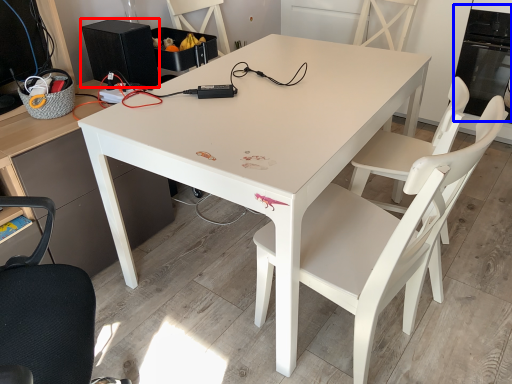
Question: Which object appears farthest to the camera in this image, appliance (highlighted by a red box) or oven (highlighted by a blue box)?

Choices:
 (A) appliance
 (B) oven

Answer: (B)